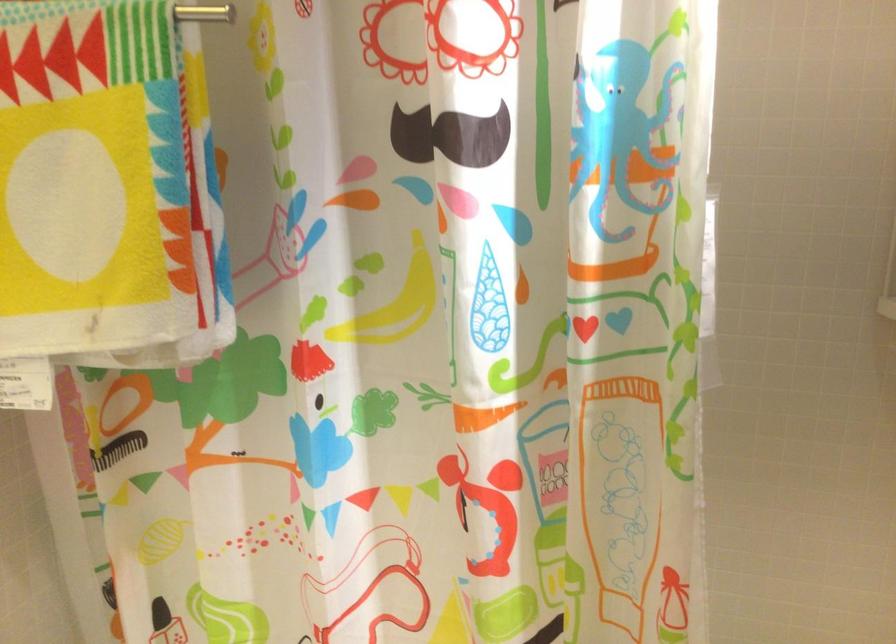
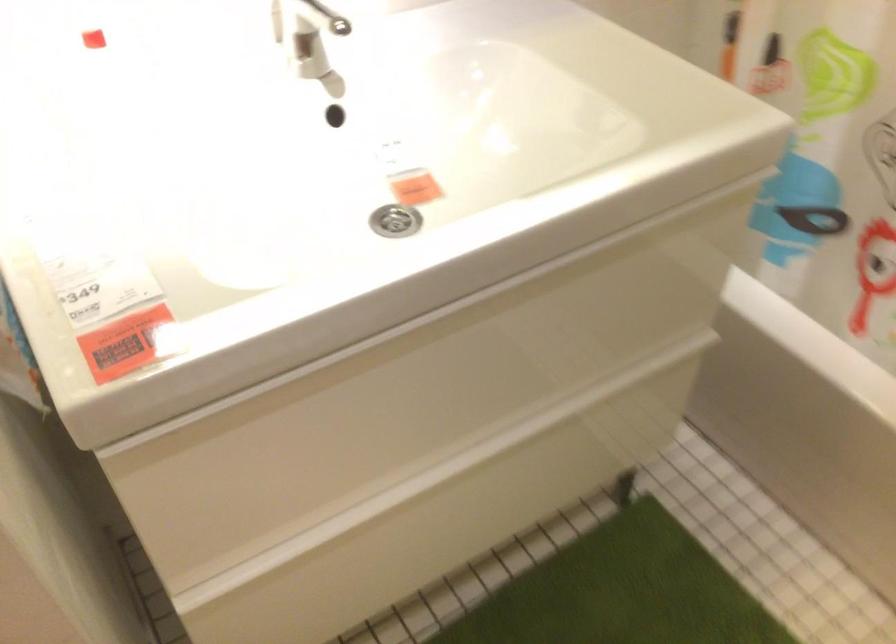
The images are taken continuously from a first-person perspective. In which direction is your viewpoint rotating?

The rotation direction of the camera is left-down.